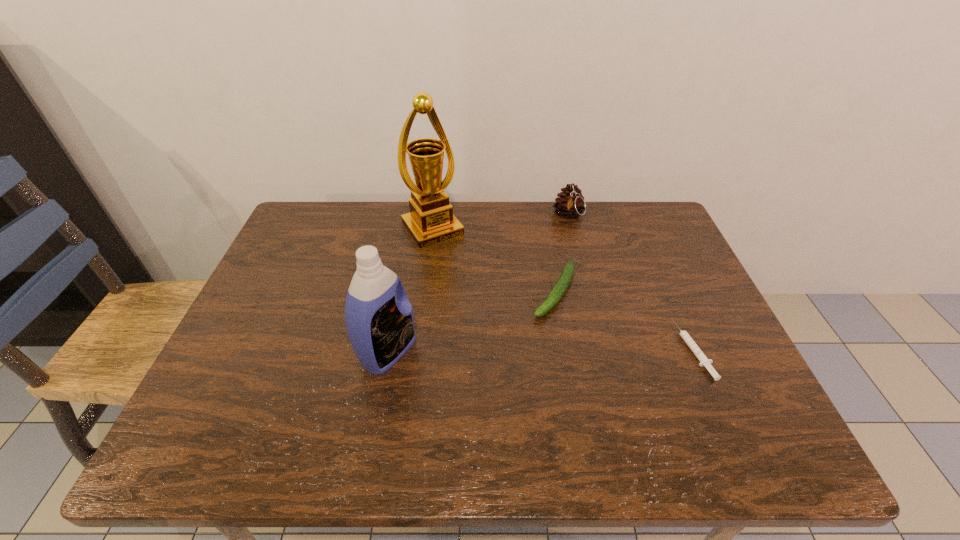
The image size is (960, 540). Identify the location of vacant point located between the detergent and the pinecone. (478, 284).

You are a GUI agent. You are given a task and a screenshot of the screen. Output one action in this format:
    pyautogui.click(x=<x>, y=<y>)
    Task: Click on the free space between the fourth tallest object and the syringe
    
    Given the screenshot: What is the action you would take?
    pyautogui.click(x=624, y=320)

You are a GUI agent. You are given a task and a screenshot of the screen. Output one action in this format:
    pyautogui.click(x=<x>, y=<y>)
    Task: Click on the free spot between the syringe and the second tallest object
    The height and width of the screenshot is (540, 960).
    Given the screenshot: What is the action you would take?
    pyautogui.click(x=540, y=350)

This screenshot has width=960, height=540. Find the location of `empty location between the pinecone and the second shortest object`. empty location between the pinecone and the second shortest object is located at coordinates (562, 253).

Locate an element on the screen. The height and width of the screenshot is (540, 960). unoccupied position between the fourth shortest object and the fourth tallest object is located at coordinates (471, 321).

Identify the location of unoccupied area between the zucchini and the second tallest object. (471, 321).

Identify the location of free space between the detergent and the zucchini. This screenshot has height=540, width=960. (471, 321).

Find the location of a particular element. The image size is (960, 540). free point between the fourth shortest object and the tallest object is located at coordinates (411, 291).

Find the location of a particular element. empty space between the third tallest object and the rightmost object is located at coordinates (631, 282).

I want to click on vacant space in between the pinecone and the zucchini, so click(x=562, y=253).